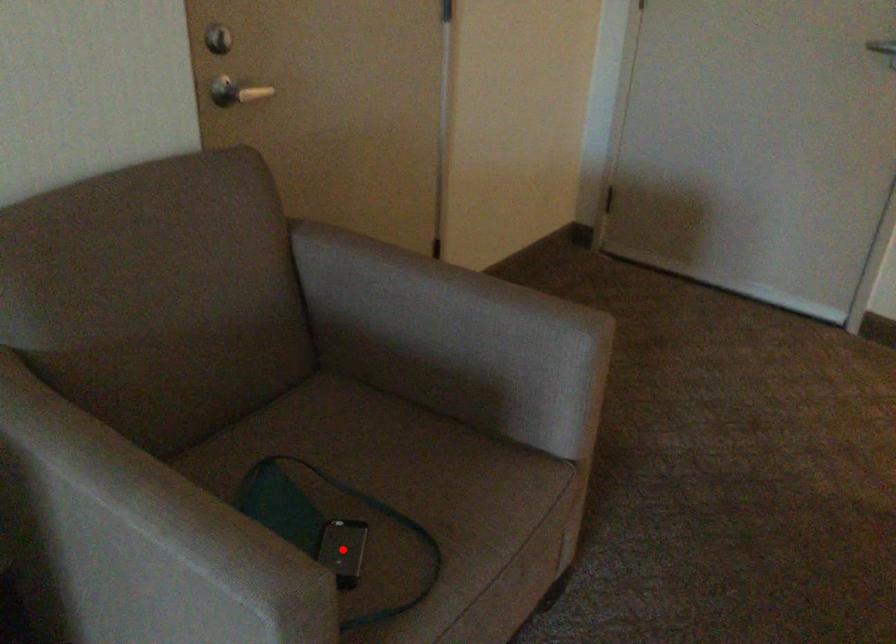
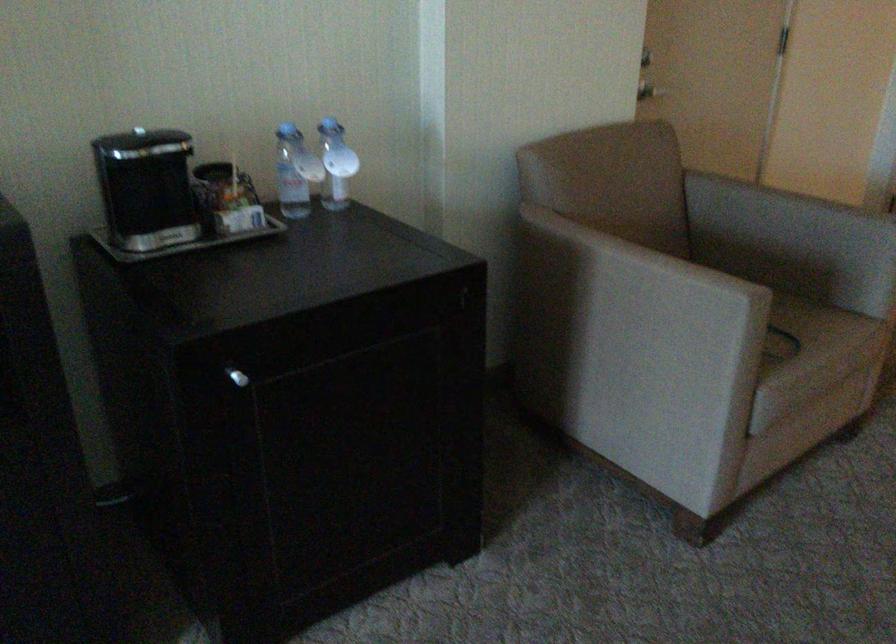
Question: I am providing you with two images of the same scene from different viewpoints. A red point is marked on the first image. At the location where the point appears in image 1, is it still visible in image 2?

Choices:
 (A) Yes
 (B) No

Answer: (B)